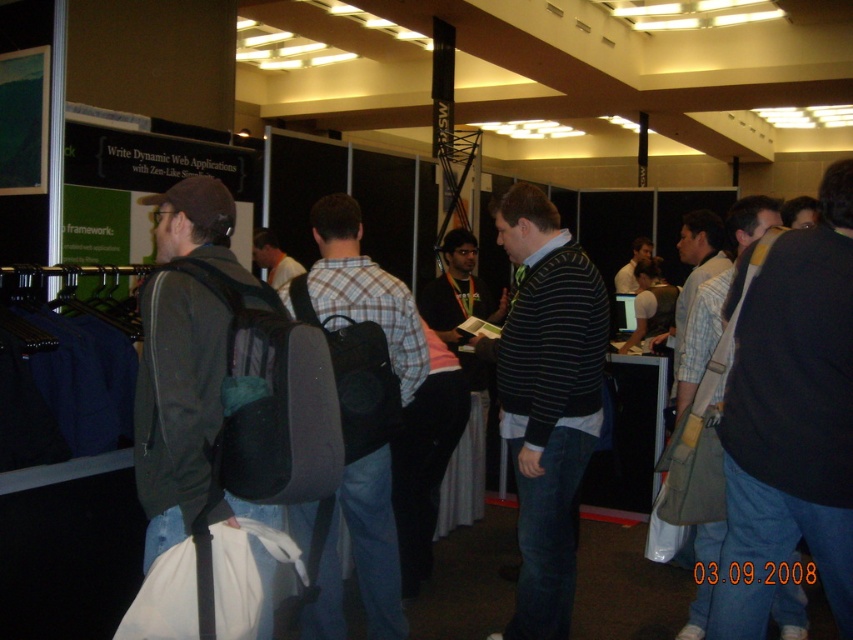
Question: From the image, what is the correct spatial relationship of dark blue sweater at center in relation to light blue shirt at center?

Choices:
 (A) right
 (B) left

Answer: (B)

Question: Which object appears closest to the camera in this image?

Choices:
 (A) dark gray backpack at left
 (B) dark blue sweater at center

Answer: (A)

Question: Can you confirm if plaid fabric shirt at center is bigger than light blue shirt at center?

Choices:
 (A) no
 (B) yes

Answer: (B)

Question: Which of the following is the farthest from the observer?

Choices:
 (A) plaid fabric shirt at center
 (B) striped sweater at center
 (C) light blue shirt at center

Answer: (C)

Question: Which of the following is the farthest from the observer?

Choices:
 (A) light blue shirt at center
 (B) dark blue sweater at center

Answer: (A)

Question: Does plaid fabric shirt at center appear on the right side of dark gray backpack at left?

Choices:
 (A) no
 (B) yes

Answer: (B)